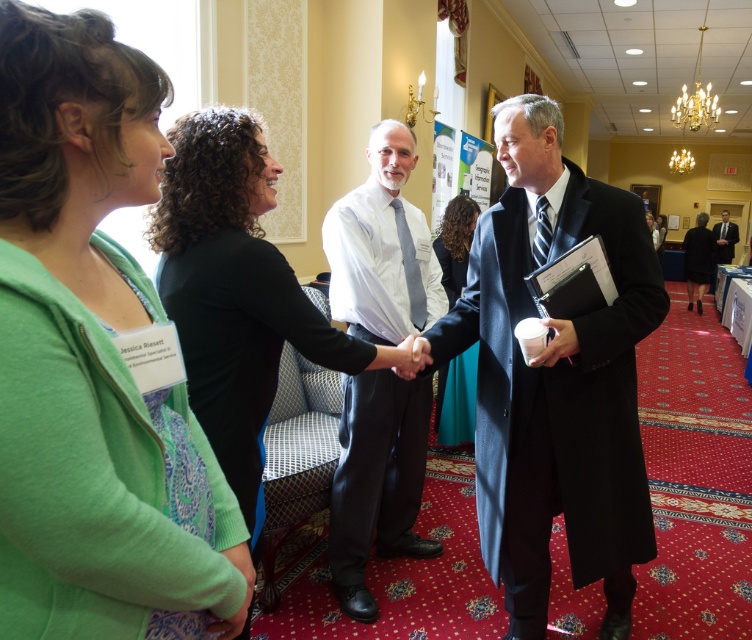
Based on the photo, you are at a networking event and see two people in the scene described. The white shirt at center and the dark suit at right are both standing. Based on their heights, which person might you expect to have a higher voice pitch?

The dark suit at right likely has a higher voice pitch since the white shirt at center is taller, and taller individuals often have lower voice pitches due to longer vocal cords.

You are attending a formal event and need to locate two specific items in the scene. The green fabric cardigan at upper left and the black jersey at center are both present. Based on their positions, which item is positioned lower in the image?

The green fabric cardigan at upper left is located below the black jersey at center, so the green fabric cardigan at upper left is positioned lower in the image.